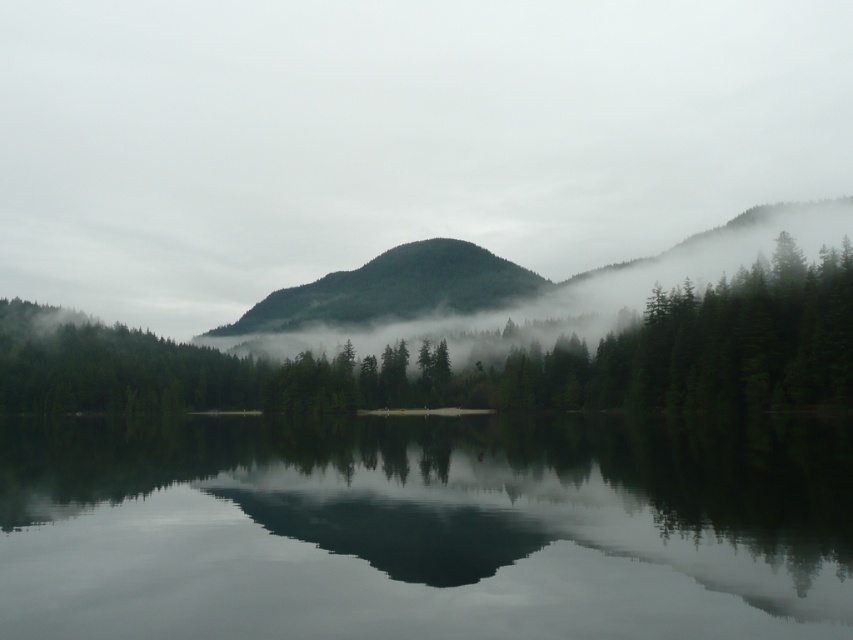
Is green matte fog at center below green matte mountain at center?

Actually, green matte fog at center is above green matte mountain at center.

From the picture: Does green matte fog at center have a lesser width compared to green matte mountain at center?

Incorrect, green matte fog at center's width is not less than green matte mountain at center's.

This screenshot has width=853, height=640. What do you see at coordinates (392, 138) in the screenshot? I see `green matte fog at center` at bounding box center [392, 138].

Find the location of `green matte fog at center`. green matte fog at center is located at coordinates (392, 138).

Consider the image. Who is higher up, smooth reflective water at center or green matte mountain at center?

green matte mountain at center is higher up.

Between smooth reflective water at center and green matte mountain at center, which one appears on the right side from the viewer's perspective?

From the viewer's perspective, smooth reflective water at center appears more on the right side.

Image resolution: width=853 pixels, height=640 pixels. What do you see at coordinates (425, 528) in the screenshot? I see `smooth reflective water at center` at bounding box center [425, 528].

At what (x,y) coordinates should I click in order to perform the action: click on smooth reflective water at center. Please return your answer as a coordinate pair (x, y). This screenshot has height=640, width=853. Looking at the image, I should click on (425, 528).

Does green matte trees at center have a smaller size compared to green matte mountain at center?

Yes, green matte trees at center is smaller than green matte mountain at center.

Does green matte trees at center have a greater width compared to green matte mountain at center?

Yes.

Does point (160, 352) lie in front of point (440, 260)?

Yes.

The width and height of the screenshot is (853, 640). Identify the location of green matte trees at center. (476, 364).